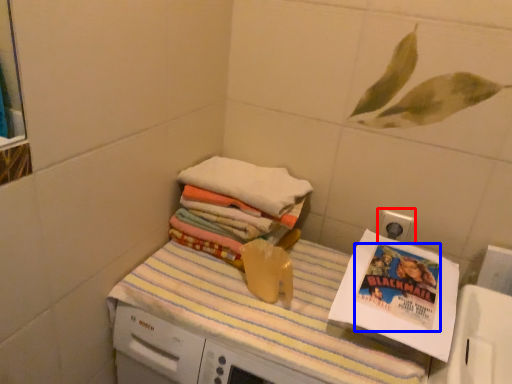
Question: Among these objects, which one is nearest to the camera, electric outlet (highlighted by a red box) or comic book (highlighted by a blue box)?

Choices:
 (A) electric outlet
 (B) comic book

Answer: (B)